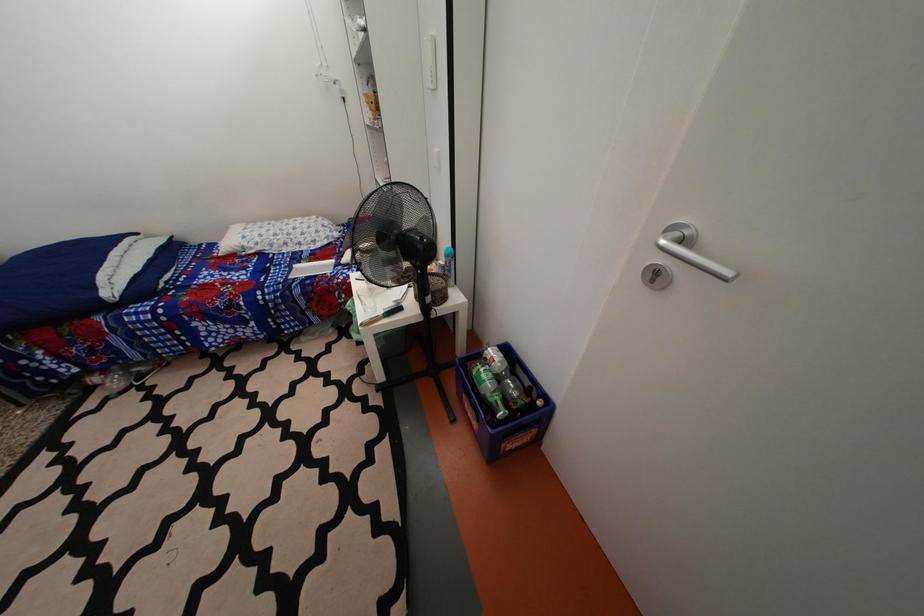
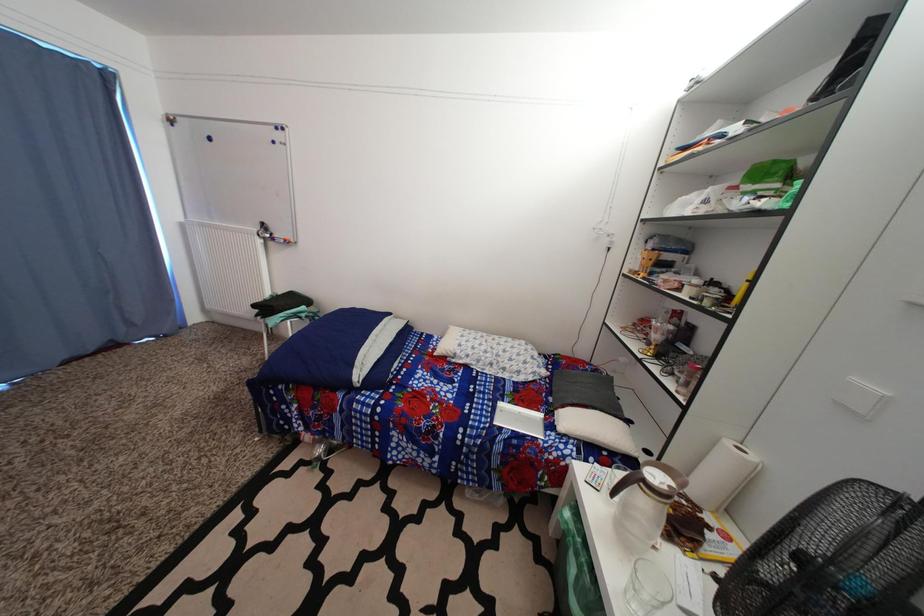
Question: The first image is from the beginning of the video and the second image is from the end. How did the camera likely rotate when shooting the video?

Choices:
 (A) Left
 (B) Right
 (C) Up
 (D) Down

Answer: (A)